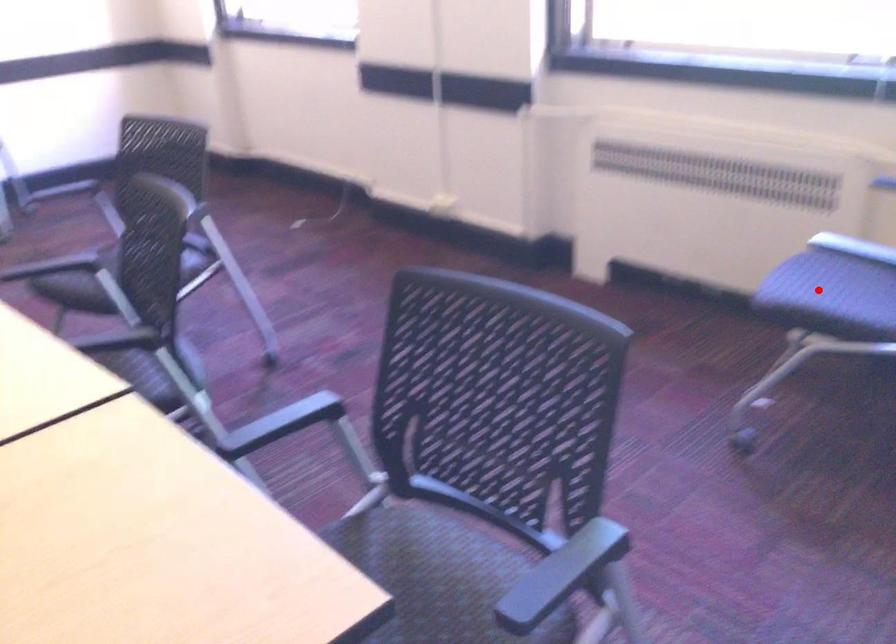
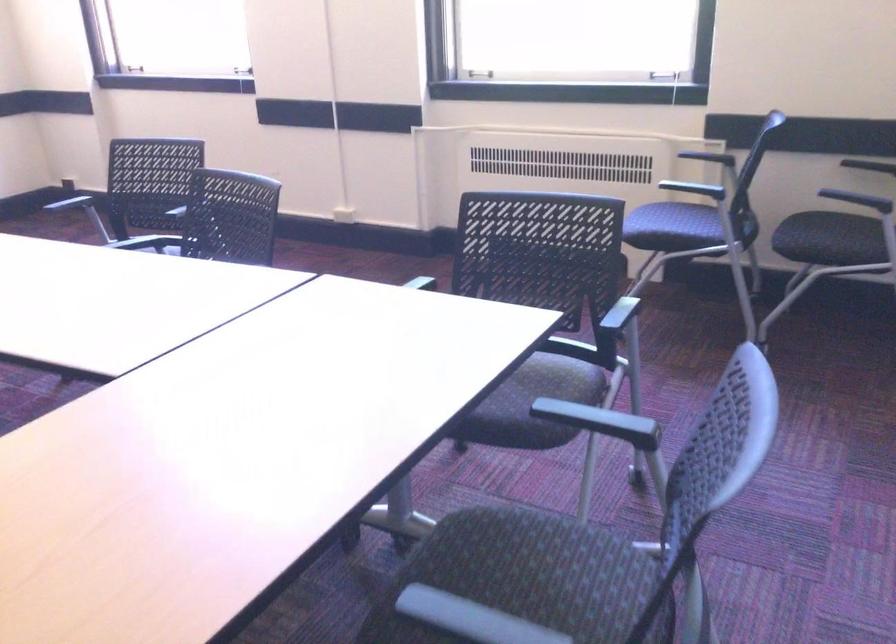
Question: I am providing you with two images of the same scene from different viewpoints. In image1, a red point is highlighted. Considering the same 3D point in image2, which of the following is correct?

Choices:
 (A) It is closer
 (B) It is farther

Answer: (B)